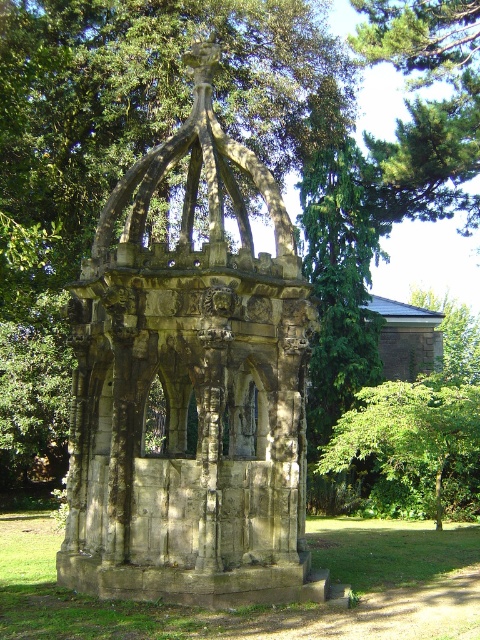
You are standing in the park and see the stone gazebo at center and the green leafy tree at center. Which object is closer to you?

The stone gazebo at center is closer to the viewer than the green leafy tree at center.

You are planning to install a new lighting system around the stone gazebo at center and the green leafy tree at center. The minimum recommended distance between any light fixture and the structures is 10 feet for safety. Based on the distance between them, can you place a single light fixture exactly between them without violating the safety distance requirement?

The distance between the stone gazebo at center and the green leafy tree at center is 43.63 feet. To place a single light fixture exactly between them, it would be 21.815 feet away from each structure. Since 21.815 feet is greater than the 10 feet minimum safety distance, the fixture can be placed between them without violating the requirement.